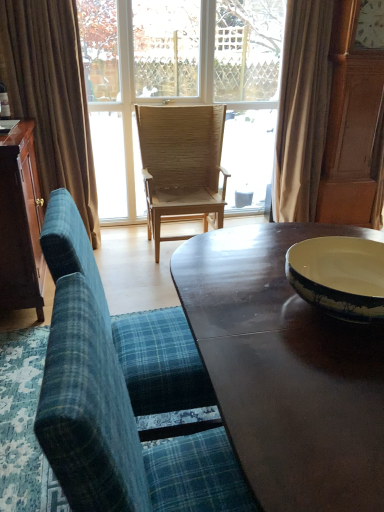
Identify the location of empty space that is ontop of shiny dark wood coffee table at center (from a real-world perspective). The height and width of the screenshot is (512, 384). (272, 311).